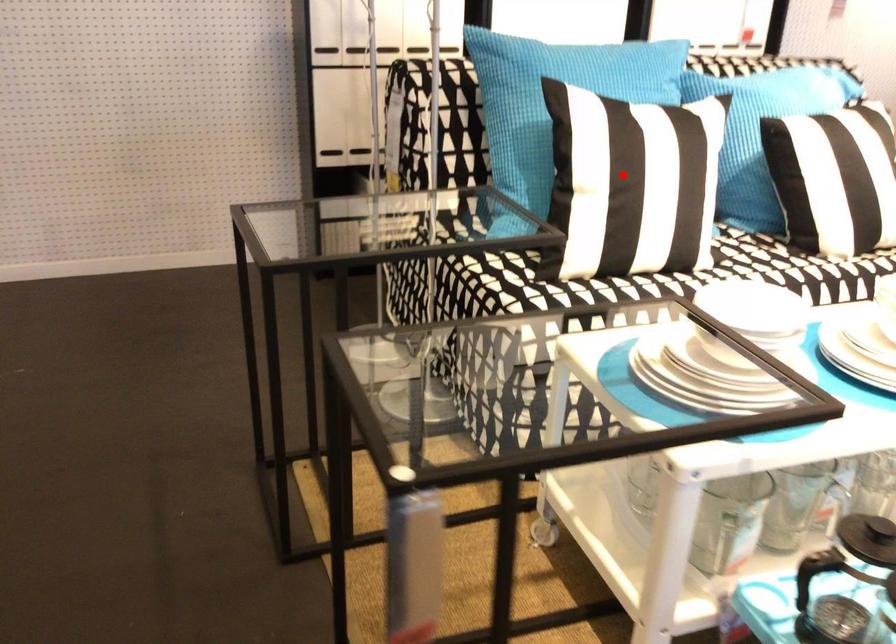
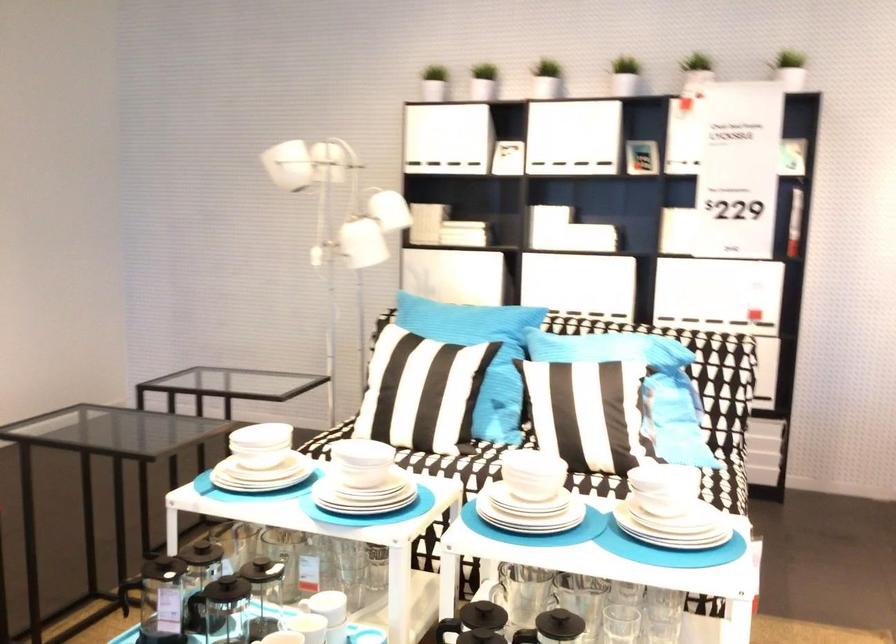
Question: I am providing you with two images of the same scene from different viewpoints. A red point is marked on the first image. At the location where the point appears in image 1, is it still visible in image 2?

Choices:
 (A) Yes
 (B) No

Answer: (A)